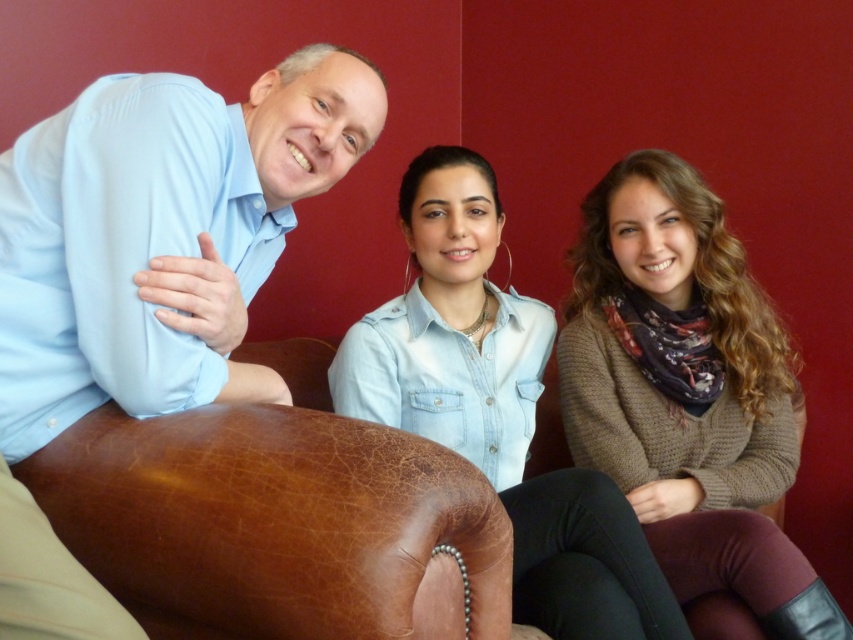
Is light blue shirt at left below denim shirt at center?

No, light blue shirt at left is not below denim shirt at center.

Does light blue shirt at left appear on the right side of denim shirt at center?

Incorrect, light blue shirt at left is not on the right side of denim shirt at center.

I want to click on light blue shirt at left, so click(x=160, y=234).

Identify the location of light blue shirt at left. (160, 234).

Does light blue shirt at left have a greater width compared to knitted brown sweater at center?

No.

Between light blue shirt at left and knitted brown sweater at center, which one has more height?

knitted brown sweater at center

Identify the location of light blue shirt at left. This screenshot has height=640, width=853. (160, 234).

In order to click on light blue shirt at left in this screenshot , I will do (x=160, y=234).

Is knitted brown sweater at center above denim shirt at center?

Incorrect, knitted brown sweater at center is not positioned above denim shirt at center.

Describe the element at coordinates (688, 392) in the screenshot. The width and height of the screenshot is (853, 640). I see `knitted brown sweater at center` at that location.

Which is behind, point (695, 262) or point (381, 381)?

The point (695, 262) is behind.

The height and width of the screenshot is (640, 853). Find the location of `knitted brown sweater at center`. knitted brown sweater at center is located at coordinates [x=688, y=392].